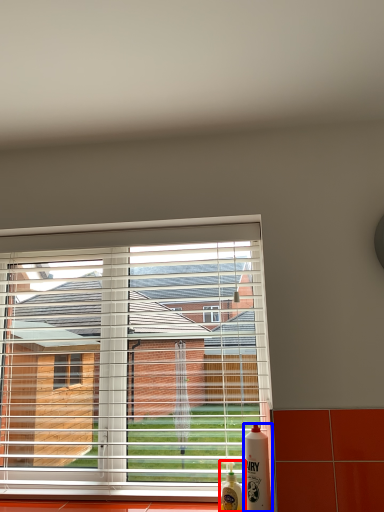
Question: Which point is closer to the camera, bottle (highlighted by a red box) or bottle (highlighted by a blue box)?

Choices:
 (A) bottle
 (B) bottle

Answer: (B)